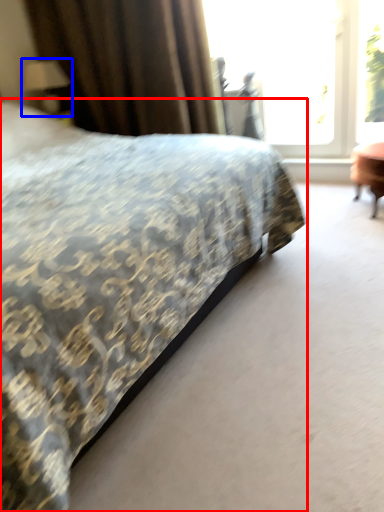
Question: Which object appears closest to the camera in this image, bed (highlighted by a red box) or table lamp (highlighted by a blue box)?

Choices:
 (A) bed
 (B) table lamp

Answer: (A)